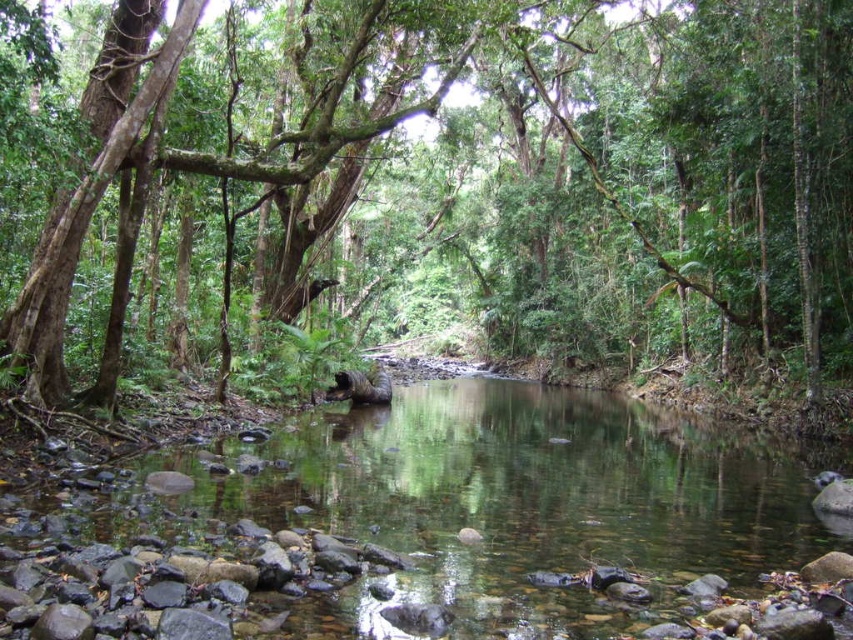
Question: Is green leafy tree at center to the left of clear water stream at center from the viewer's perspective?

Choices:
 (A) no
 (B) yes

Answer: (A)

Question: Which point is closer to the camera?

Choices:
 (A) (749, 448)
 (B) (398, 260)

Answer: (A)

Question: Can you confirm if green leafy tree at center is smaller than clear water stream at center?

Choices:
 (A) no
 (B) yes

Answer: (A)

Question: Can you confirm if green leafy tree at center is positioned to the right of clear water stream at center?

Choices:
 (A) no
 (B) yes

Answer: (B)